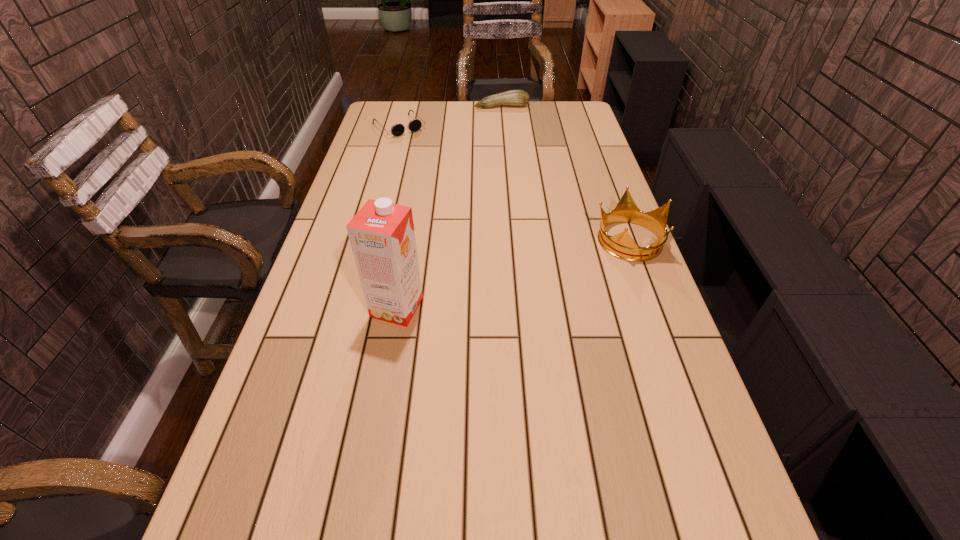
Identify the location of vacant space that's between the second object from right to left and the sunglasses. The image size is (960, 540). (450, 117).

At what (x,y) coordinates should I click in order to perform the action: click on free space between the zucchini and the sunglasses. Please return your answer as a coordinate pair (x, y). The height and width of the screenshot is (540, 960). Looking at the image, I should click on (450, 117).

Locate an element on the screen. The image size is (960, 540). free space between the farthest object and the shortest object is located at coordinates (450, 117).

In order to click on blank region between the farthest object and the third nearest object in this screenshot , I will do `click(450, 117)`.

The height and width of the screenshot is (540, 960). In order to click on free point between the farthest object and the rightmost object in this screenshot , I will do `click(565, 173)`.

Locate an element on the screen. This screenshot has width=960, height=540. object that stands as the third closest to the nearest object is located at coordinates (518, 98).

I want to click on object that is the second nearest to the tallest object, so click(x=414, y=125).

Identify the location of vacant space that satisfies the following two spatial constraints: 1. on the front side of the crown; 2. on the left side of the second object from right to left. (513, 239).

Where is `free spot that satisfies the following two spatial constraints: 1. on the back side of the farthest object; 2. on the left side of the nearest object`? The width and height of the screenshot is (960, 540). free spot that satisfies the following two spatial constraints: 1. on the back side of the farthest object; 2. on the left side of the nearest object is located at coordinates (432, 106).

You are a GUI agent. You are given a task and a screenshot of the screen. Output one action in this format:
    pyautogui.click(x=<x>, y=<y>)
    Task: Click on the vacant space that satisfies the following two spatial constraints: 1. on the back side of the farthest object; 2. on the right side of the second farthest object
    
    Given the screenshot: What is the action you would take?
    404,106